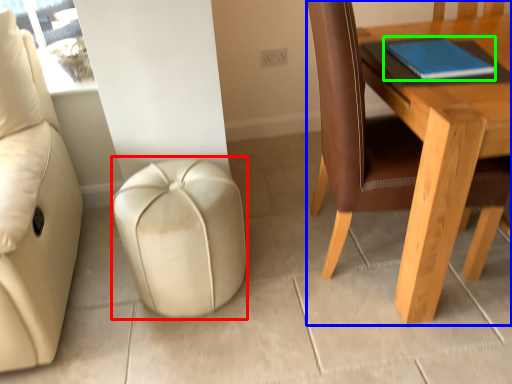
Question: Which object is positioned farthest from stool (highlighted by a red box)? Select from table (highlighted by a blue box) and notebook (highlighted by a green box).

Choices:
 (A) table
 (B) notebook

Answer: (B)